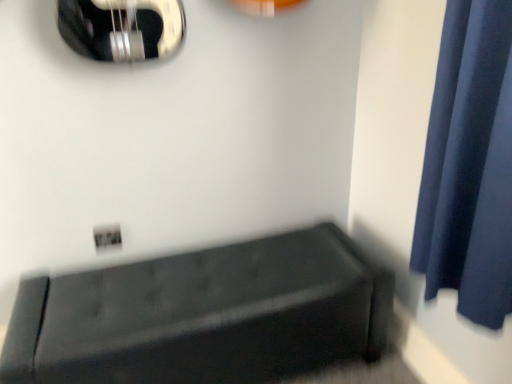
Question: Visually, is velvet black bench at lower right positioned to the left or to the right of dark blue fabric curtain at right?

Choices:
 (A) left
 (B) right

Answer: (A)

Question: Considering the positions of velvet black bench at lower right and dark blue fabric curtain at right in the image, is velvet black bench at lower right taller or shorter than dark blue fabric curtain at right?

Choices:
 (A) short
 (B) tall

Answer: (A)

Question: Is velvet black bench at lower right inside or outside of dark blue fabric curtain at right?

Choices:
 (A) inside
 (B) outside

Answer: (B)

Question: From the image's perspective, is dark blue fabric curtain at right above or below velvet black bench at lower right?

Choices:
 (A) above
 (B) below

Answer: (A)

Question: Is point (463, 6) closer or farther from the camera than point (192, 283)?

Choices:
 (A) closer
 (B) farther

Answer: (A)

Question: Is dark blue fabric curtain at right wider or thinner than velvet black bench at lower right?

Choices:
 (A) wide
 (B) thin

Answer: (B)

Question: In the image, is dark blue fabric curtain at right positioned in front of or behind velvet black bench at lower right?

Choices:
 (A) behind
 (B) front

Answer: (B)